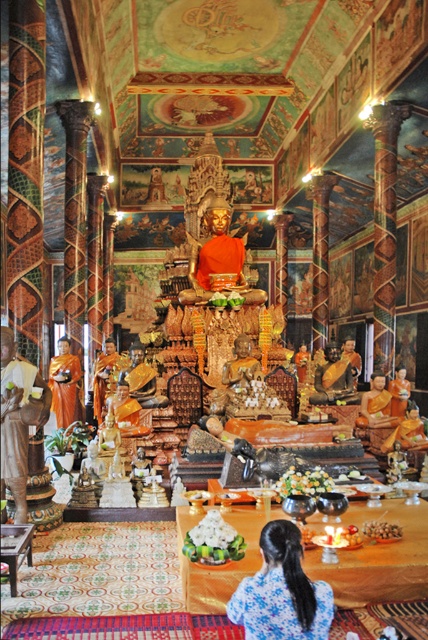
Does blue silk dress at center appear on the left side of gold metallic statue at left?

No, blue silk dress at center is not to the left of gold metallic statue at left.

Consider the image. Who is more distant from viewer, (282,636) or (12,483)?

Positioned behind is point (12,483).

Identify the location of blue silk dress at center. Image resolution: width=428 pixels, height=640 pixels. (282, 592).

Is point (5, 406) farther from camera compared to point (64, 342)?

That is False.

From the picture: Does gold metallic statue at left have a greater width compared to orange fabric robe at center?

Incorrect, gold metallic statue at left's width does not surpass orange fabric robe at center's.

Which is in front, point (24, 460) or point (65, 348)?

Point (24, 460) is in front.

Identify the location of gold metallic statue at left. (18, 419).

Is blue silk dress at center taller than orange fabric robe at center?

In fact, blue silk dress at center may be shorter than orange fabric robe at center.

I want to click on blue silk dress at center, so click(x=282, y=592).

You are a GUI agent. You are given a task and a screenshot of the screen. Output one action in this format:
    pyautogui.click(x=<x>, y=<y>)
    Task: Click on the blue silk dress at center
    Image resolution: width=428 pixels, height=640 pixels.
    Given the screenshot: What is the action you would take?
    pyautogui.click(x=282, y=592)